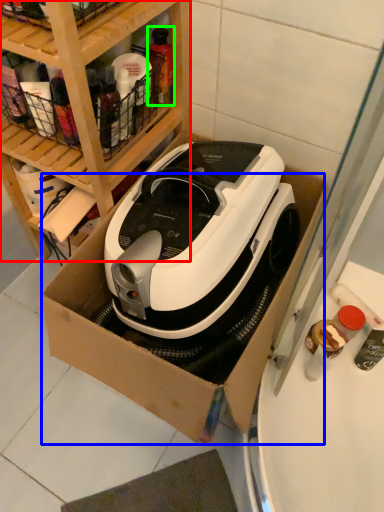
Question: Considering the real-world distances, which object is closest to shelf (highlighted by a red box)? cardboard box (highlighted by a blue box) or bottle (highlighted by a green box).

Choices:
 (A) cardboard box
 (B) bottle

Answer: (B)